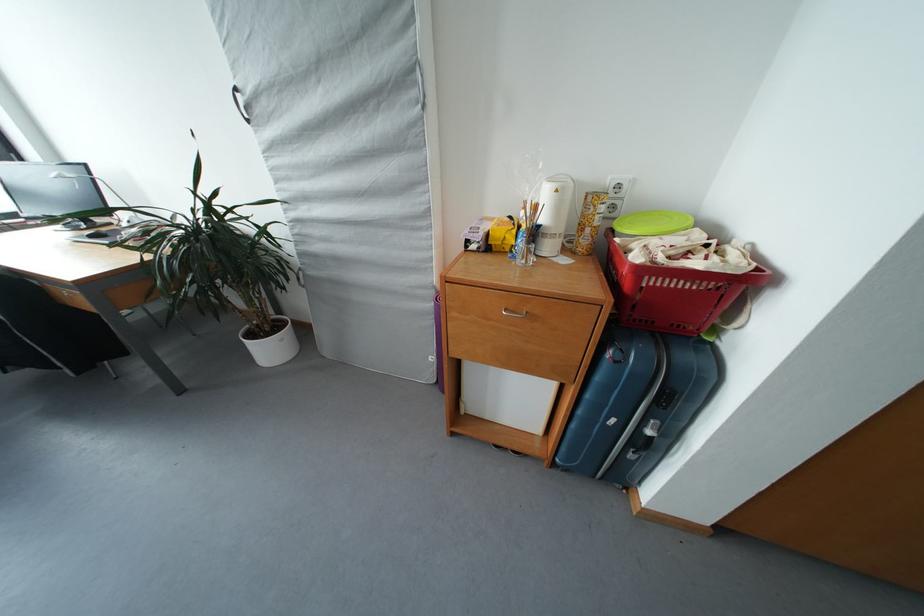
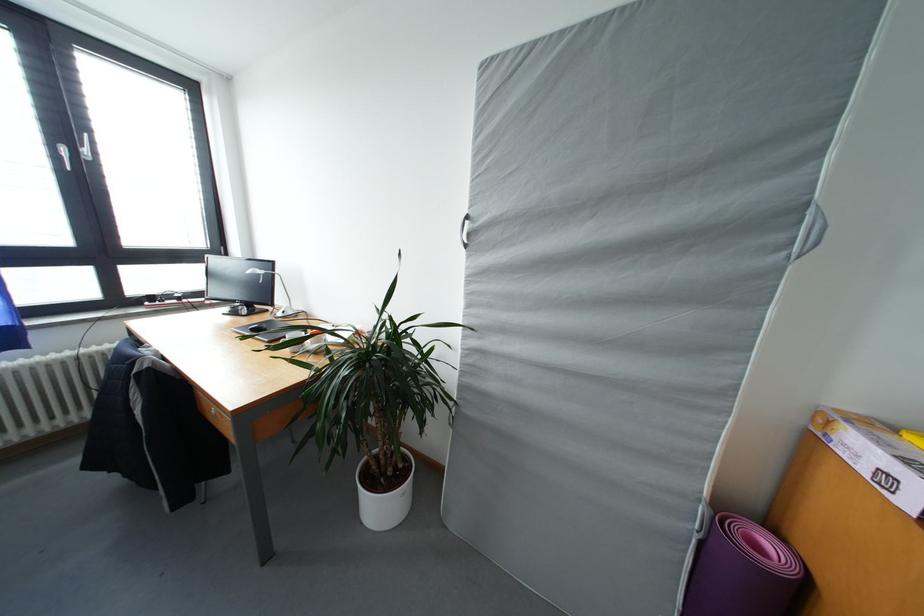
The images are taken continuously from a first-person perspective. In which direction are you moving?

The cameraman moved toward left, forward.